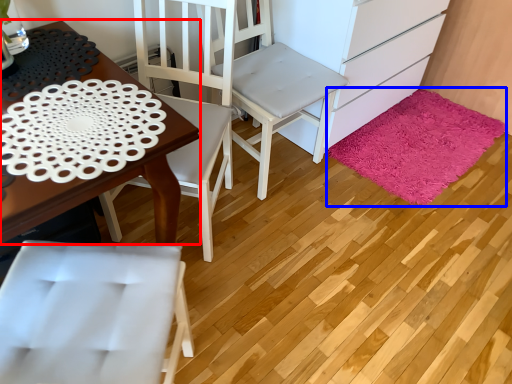
Question: Which object is further to the camera taking this photo, desk (highlighted by a red box) or mat (highlighted by a blue box)?

Choices:
 (A) desk
 (B) mat

Answer: (B)